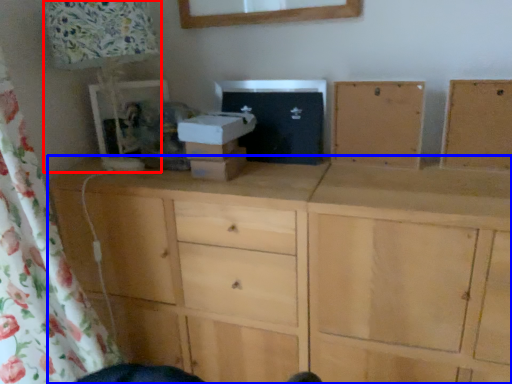
Question: Among these objects, which one is farthest to the camera, table lamp (highlighted by a red box) or chest of drawers (highlighted by a blue box)?

Choices:
 (A) table lamp
 (B) chest of drawers

Answer: (A)